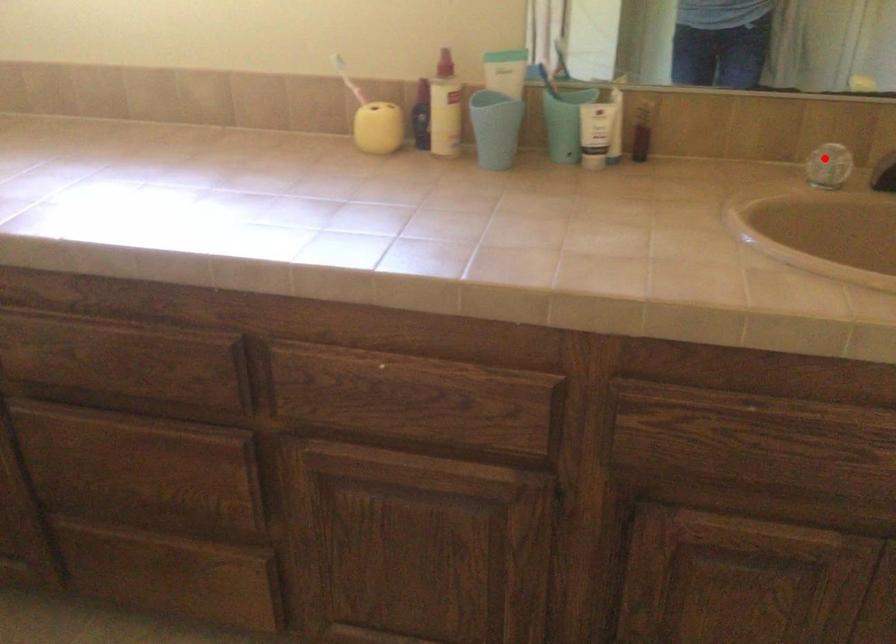
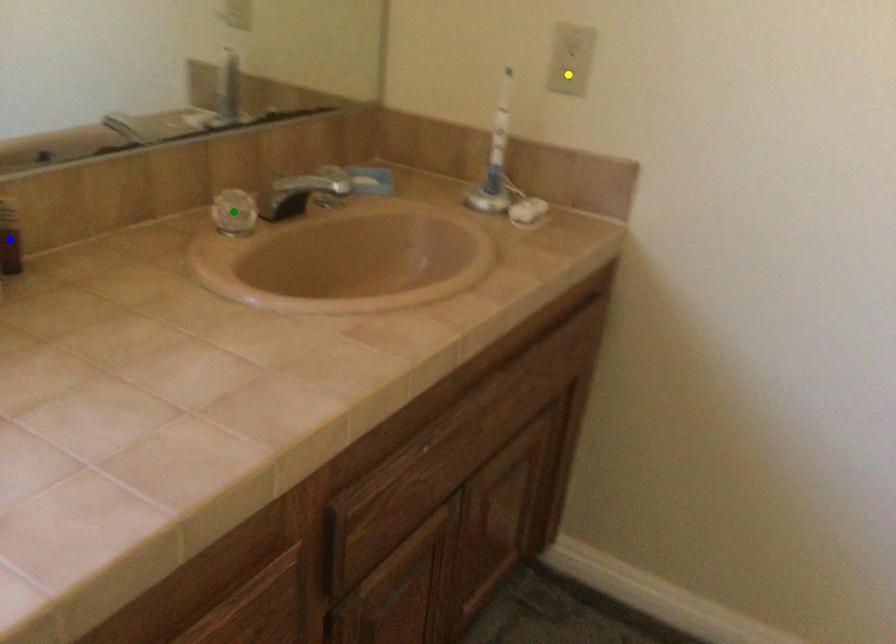
Question: I am providing you with two images of the same scene from different viewpoints. A red point is marked on the first image. You are given multiple points on the second image. Which point in image 2 represents the same 3d spot as the red point in image 1?

Choices:
 (A) blue point
 (B) green point
 (C) yellow point

Answer: (B)